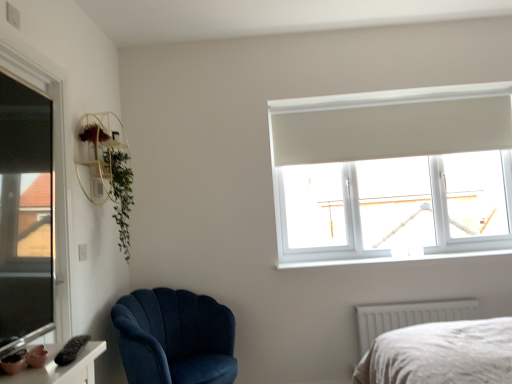
Question: Would you say matte pink ceramic at lower left contains white plastic window sill at upper right?

Choices:
 (A) yes
 (B) no

Answer: (B)

Question: Considering the relative sizes of matte pink ceramic at lower left and white plastic window sill at upper right in the image provided, is matte pink ceramic at lower left thinner than white plastic window sill at upper right?

Choices:
 (A) no
 (B) yes

Answer: (B)

Question: Considering the relative positions of matte pink ceramic at lower left and white plastic window sill at upper right in the image provided, is matte pink ceramic at lower left to the right of white plastic window sill at upper right from the viewer's perspective?

Choices:
 (A) no
 (B) yes

Answer: (A)

Question: Is the position of matte pink ceramic at lower left less distant than that of white plastic window sill at upper right?

Choices:
 (A) no
 (B) yes

Answer: (B)

Question: From the image's perspective, is matte pink ceramic at lower left located beneath white plastic window sill at upper right?

Choices:
 (A) no
 (B) yes

Answer: (A)

Question: Looking at the image, does velvet blue armchair at lower left seem bigger or smaller compared to transparent glass window at upper right, the first window from the right?

Choices:
 (A) small
 (B) big

Answer: (B)

Question: Looking at their shapes, would you say velvet blue armchair at lower left is wider or thinner than transparent glass window at upper right, the first window from the right?

Choices:
 (A) wide
 (B) thin

Answer: (A)

Question: Does point (203, 296) appear closer or farther from the camera than point (375, 162)?

Choices:
 (A) farther
 (B) closer

Answer: (B)

Question: Relative to transparent glass window at upper right, the first window from the right, is velvet blue armchair at lower left in front or behind?

Choices:
 (A) behind
 (B) front

Answer: (B)

Question: From a real-world perspective, is velvet blue armchair at lower left positioned above or below matte pink ceramic at lower left?

Choices:
 (A) above
 (B) below

Answer: (B)

Question: From the image's perspective, relative to matte pink ceramic at lower left, is velvet blue armchair at lower left above or below?

Choices:
 (A) below
 (B) above

Answer: (A)

Question: In terms of width, does velvet blue armchair at lower left look wider or thinner when compared to matte pink ceramic at lower left?

Choices:
 (A) thin
 (B) wide

Answer: (B)

Question: Considering the positions of point (230, 347) and point (29, 370), is point (230, 347) closer or farther from the camera than point (29, 370)?

Choices:
 (A) closer
 (B) farther

Answer: (B)

Question: In terms of height, does green leafy plant at upper left look taller or shorter compared to white plastic window sill at upper right?

Choices:
 (A) tall
 (B) short

Answer: (A)

Question: Considering the relative positions of green leafy plant at upper left and white plastic window sill at upper right in the image provided, is green leafy plant at upper left to the left or to the right of white plastic window sill at upper right?

Choices:
 (A) left
 (B) right

Answer: (A)